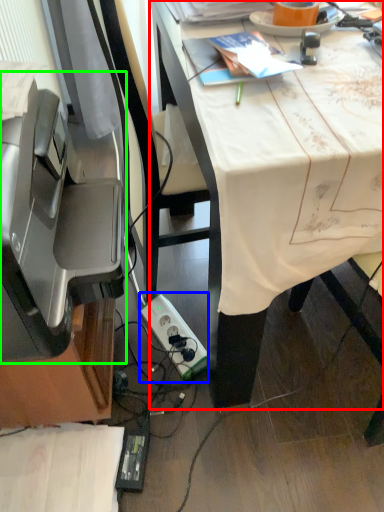
Question: Which is nearer to the desk (highlighted by a red box)? power plugs and sockets (highlighted by a blue box) or printer (highlighted by a green box).

Choices:
 (A) power plugs and sockets
 (B) printer

Answer: (B)